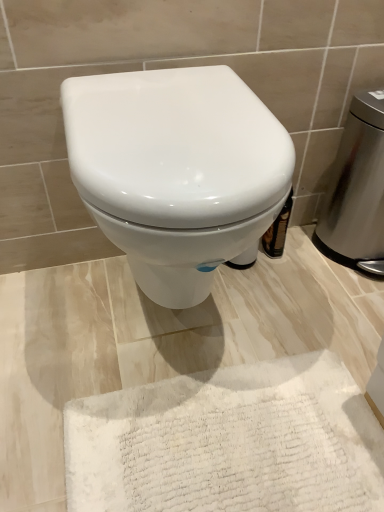
Question: Is white fluffy bath mat at lower center outside of white glossy toilet at center?

Choices:
 (A) yes
 (B) no

Answer: (A)

Question: Considering the relative positions of white fluffy bath mat at lower center and white glossy toilet at center in the image provided, is white fluffy bath mat at lower center to the right of white glossy toilet at center from the viewer's perspective?

Choices:
 (A) no
 (B) yes

Answer: (B)

Question: Is the position of white fluffy bath mat at lower center less distant than that of white glossy toilet at center?

Choices:
 (A) no
 (B) yes

Answer: (A)

Question: Can you confirm if white fluffy bath mat at lower center is thinner than white glossy toilet at center?

Choices:
 (A) no
 (B) yes

Answer: (A)

Question: From a real-world perspective, does white fluffy bath mat at lower center sit lower than white glossy toilet at center?

Choices:
 (A) yes
 (B) no

Answer: (A)

Question: Is point (347, 113) closer or farther from the camera than point (215, 181)?

Choices:
 (A) closer
 (B) farther

Answer: (B)

Question: From the image's perspective, is stainless steel trash can at right above or below white glossy toilet at center?

Choices:
 (A) below
 (B) above

Answer: (B)

Question: In terms of height, does stainless steel trash can at right look taller or shorter compared to white glossy toilet at center?

Choices:
 (A) short
 (B) tall

Answer: (B)

Question: In terms of width, does stainless steel trash can at right look wider or thinner when compared to white glossy toilet at center?

Choices:
 (A) thin
 (B) wide

Answer: (A)

Question: Is white glossy toilet at center inside the boundaries of white fluffy bath mat at lower center, or outside?

Choices:
 (A) outside
 (B) inside

Answer: (A)

Question: Considering the positions of white glossy toilet at center and white fluffy bath mat at lower center in the image, is white glossy toilet at center wider or thinner than white fluffy bath mat at lower center?

Choices:
 (A) thin
 (B) wide

Answer: (A)

Question: From their relative heights in the image, would you say white glossy toilet at center is taller or shorter than white fluffy bath mat at lower center?

Choices:
 (A) short
 (B) tall

Answer: (B)

Question: Is point (254, 99) positioned closer to the camera than point (125, 407)?

Choices:
 (A) farther
 (B) closer

Answer: (B)

Question: From a real-world perspective, is white fluffy bath mat at lower center physically located above or below stainless steel trash can at right?

Choices:
 (A) above
 (B) below

Answer: (B)

Question: Is white fluffy bath mat at lower center wider or thinner than stainless steel trash can at right?

Choices:
 (A) thin
 (B) wide

Answer: (B)